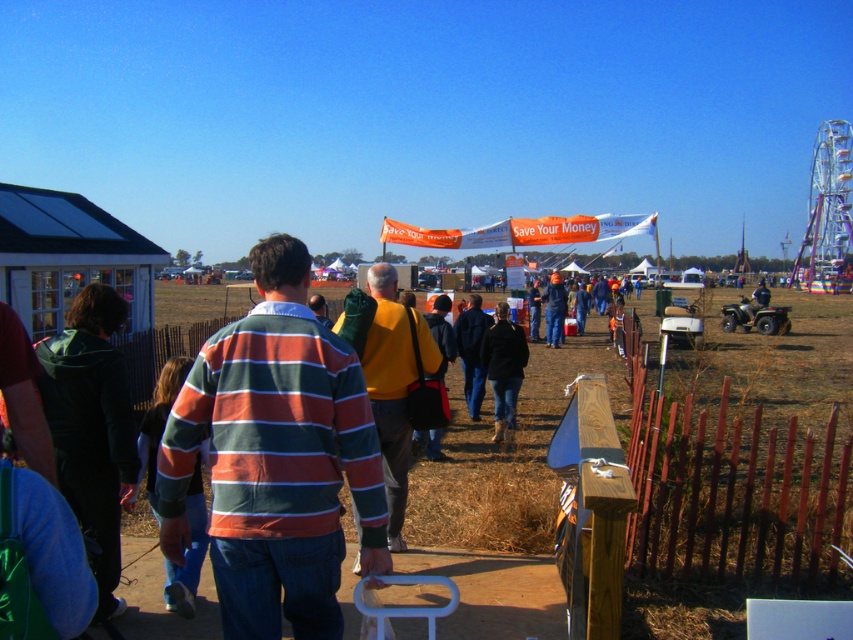
Who is taller, dark green hoodie at left or yellow sweater at center?

Standing taller between the two is yellow sweater at center.

Is dark green hoodie at left below yellow sweater at center?

Indeed, dark green hoodie at left is positioned under yellow sweater at center.

Measure the distance between dark green hoodie at left and camera.

dark green hoodie at left is 3.10 meters from camera.

Where is `dark green hoodie at left`? dark green hoodie at left is located at coordinates (91, 426).

Between point (252, 616) and point (492, 376), which one is positioned in front?

Point (252, 616) is more forward.

Consider the image. Is striped cotton shirt at center thinner than dark blue jeans at center?

Incorrect, striped cotton shirt at center's width is not less than dark blue jeans at center's.

Where is `striped cotton shirt at center`? striped cotton shirt at center is located at coordinates (276, 458).

Is dark green hoodie at left taller than orange striped sweater at center?

No, dark green hoodie at left is not taller than orange striped sweater at center.

Which is more to the left, dark green hoodie at left or orange striped sweater at center?

From the viewer's perspective, dark green hoodie at left appears more on the left side.

Where is `dark green hoodie at left`? The width and height of the screenshot is (853, 640). dark green hoodie at left is located at coordinates (91, 426).